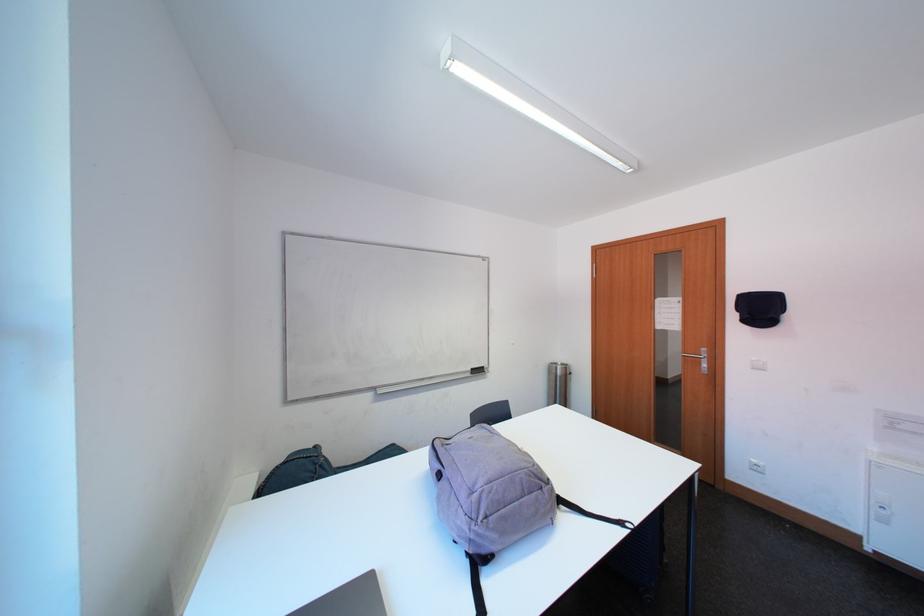
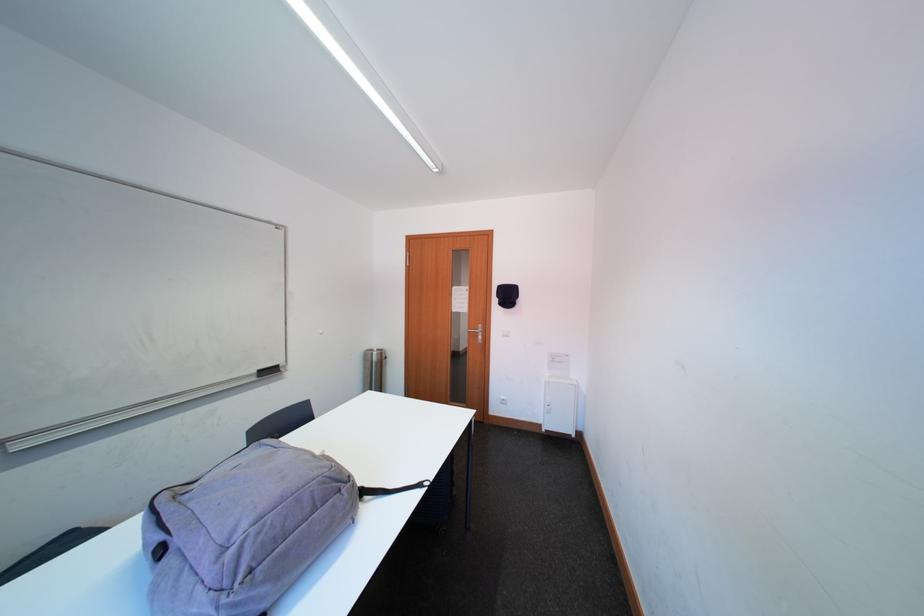
The point at (565, 371) is marked in the first image. Where is the corresponding point in the second image?

(382, 358)